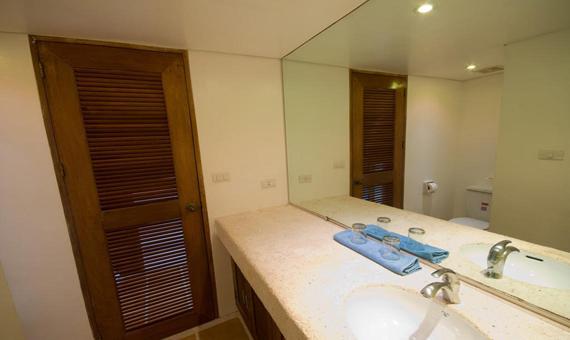
Identify the location of reflection of toilet. Image resolution: width=570 pixels, height=340 pixels. (473, 220).